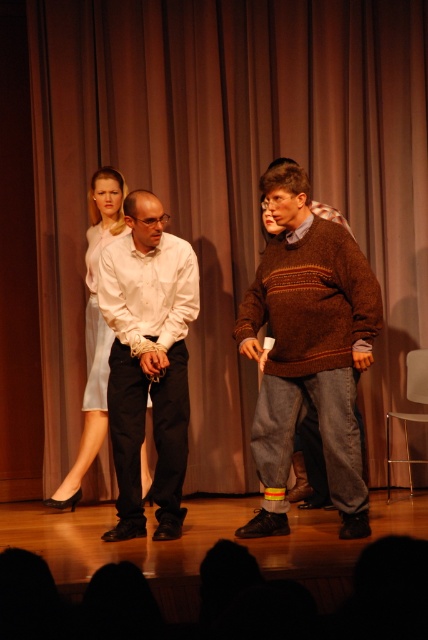
You are a stagehand responsible for adjusting the lighting. You need to position a spotlight so that it illuminates both the brown woolen sweater at center and the camera. Given that they are 3.64 meters apart, what is the minimum distance the spotlight should be placed from the camera to ensure both are fully lit?

The minimum distance the spotlight should be placed from the camera is 1.82 meters, which is half of 3.64 meters, to ensure both the brown woolen sweater at center and the camera are fully illuminated.

You are an actor on stage and need to exit through a door behind the brown fabric curtain at center and the knitted brown sweater at center. Which object must you move past first?

You must move past the knitted brown sweater at center first because the brown fabric curtain at center is further away from you, so the knitted brown sweater at center is closer to your current position.

You are a stagehand trying to place a new prop on the stage. The knitted brown sweater at center is currently at coordinates point 0.547, 0.722. If you need to place the new prop 0.1 units to the right and 0.05 units above the sweater, what are the new coordinates for the prop?

The new coordinates for the prop would be 0.547 plus 0.1 equals 0.647 in the x direction and 0.722 plus 0.05 equals 0.772 in the y direction. So the new coordinates are point (330, 413).